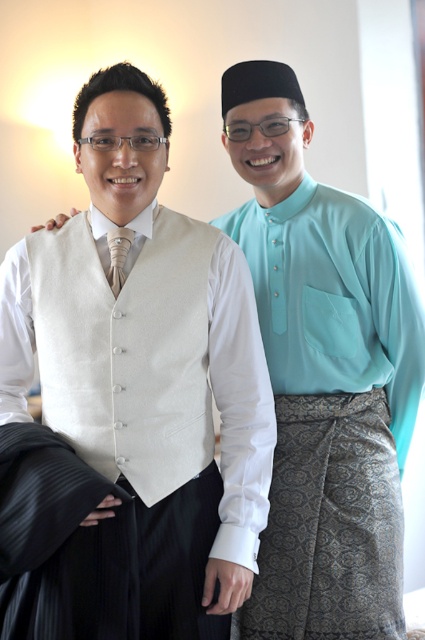
Is beige wool vest at center above matte silk tie at center?

Incorrect, beige wool vest at center is not positioned above matte silk tie at center.

Which is behind, point (150, 460) or point (108, 237)?

The point (108, 237) is more distant.

You are a GUI agent. You are given a task and a screenshot of the screen. Output one action in this format:
    pyautogui.click(x=<x>, y=<y>)
    Task: Click on the beige wool vest at center
    The height and width of the screenshot is (640, 425).
    Given the screenshot: What is the action you would take?
    pyautogui.click(x=127, y=352)